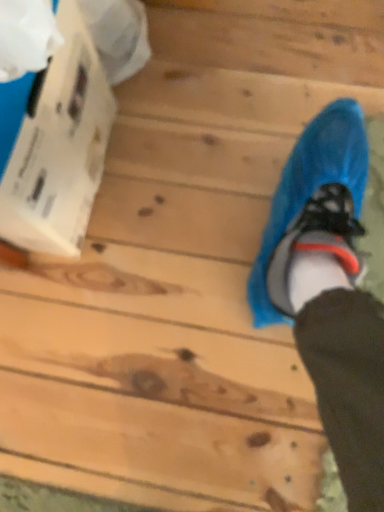
The height and width of the screenshot is (512, 384). I want to click on white cardboard box at upper left, so click(x=54, y=143).

What do you see at coordinates (54, 143) in the screenshot? I see `white cardboard box at upper left` at bounding box center [54, 143].

Find the location of a particular element. white cardboard box at upper left is located at coordinates (54, 143).